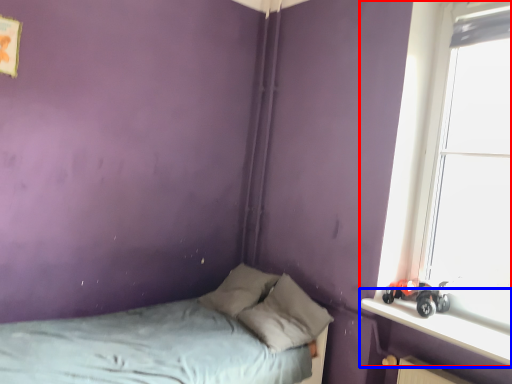
Question: Which point is further to the camera, window (highlighted by a red box) or window sill (highlighted by a blue box)?

Choices:
 (A) window
 (B) window sill

Answer: (A)